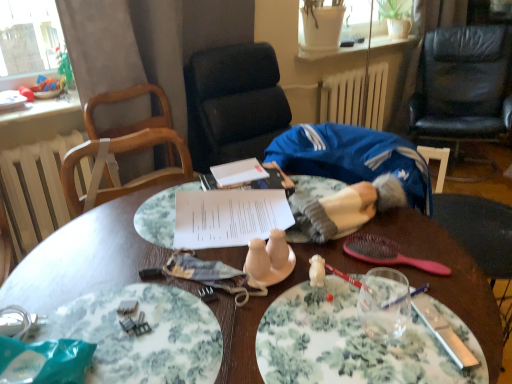
Where is `free spot above wooden table at center (from a real-world perspective)`? The width and height of the screenshot is (512, 384). free spot above wooden table at center (from a real-world perspective) is located at coordinates (230, 278).